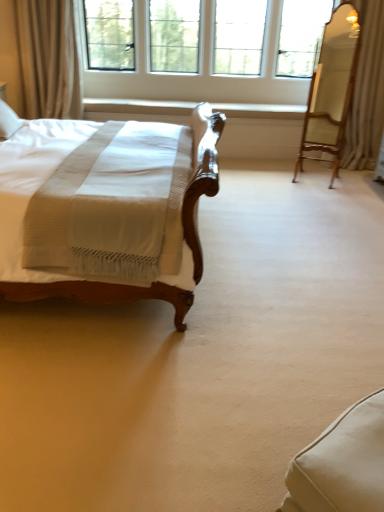
Question: Looking at their shapes, would you say beige fabric curtain at upper left, arranged as the 1th curtain when viewed from the left, is wider or thinner than wooden swivel chair at right, the 2th swivel chair in the front-to-back sequence?

Choices:
 (A) thin
 (B) wide

Answer: (B)

Question: From a real-world perspective, is beige fabric curtain at upper left, the second curtain viewed from the right, above or below wooden swivel chair at right, which ranks as the first swivel chair in top-to-bottom order?

Choices:
 (A) above
 (B) below

Answer: (A)

Question: Which of these objects is positioned closest to the white textured curtain at upper right, which appears as the first curtain when viewed from the right?

Choices:
 (A) white fabric swivel chair at lower right, which is the second swivel chair from top to bottom
 (B) beige fabric curtain at upper left, the second curtain viewed from the right
 (C) wooden swivel chair at right, which appears as the 2th swivel chair when viewed from the left
 (D) clear glass window at upper center

Answer: (C)

Question: Based on their relative distances, which object is farther from the beige fabric curtain at upper left, arranged as the 1th curtain when viewed from the left?

Choices:
 (A) clear glass window at upper center
 (B) white fabric swivel chair at lower right, positioned as the first swivel chair in bottom-to-top order
 (C) white textured curtain at upper right, the second curtain from the left
 (D) wooden swivel chair at right, the 2th swivel chair in the front-to-back sequence

Answer: (B)